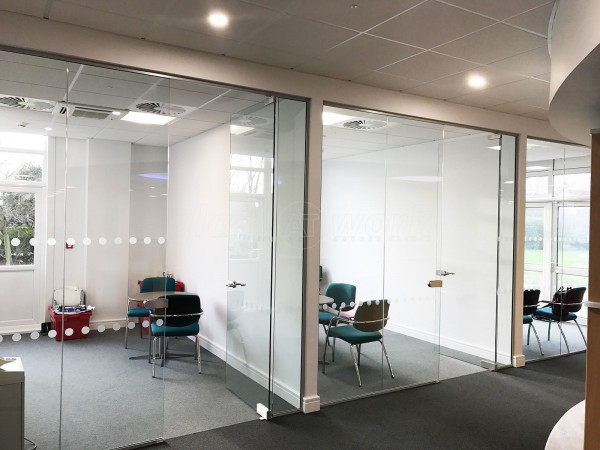
Find the location of a particular element. The image size is (600, 450). handle is located at coordinates (236, 280), (447, 273).